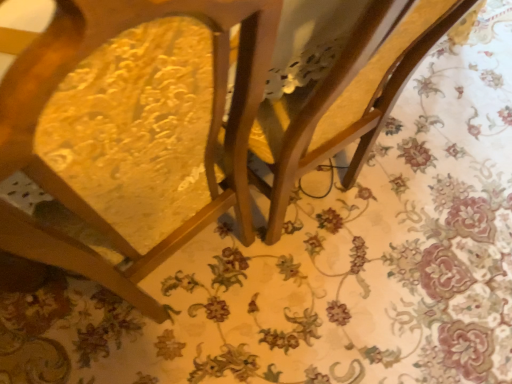
Locate an element on the screen. The image size is (512, 384). wooden chair at center is located at coordinates (206, 144).

Describe the element at coordinates (206, 144) in the screenshot. I see `wooden chair at center` at that location.

Describe the element at coordinates (346, 97) in the screenshot. This screenshot has width=512, height=384. I see `wooden swivel chair at center` at that location.

Measure the distance between wooden swivel chair at center and camera.

wooden swivel chair at center is 18.54 inches from camera.

The height and width of the screenshot is (384, 512). Find the location of `wooden swivel chair at center`. wooden swivel chair at center is located at coordinates (346, 97).

Locate an element on the screen. The width and height of the screenshot is (512, 384). wooden chair at center is located at coordinates (206, 144).

Which is more to the left, wooden chair at center or wooden swivel chair at center?

wooden chair at center is more to the left.

Is wooden chair at center closer to camera compared to wooden swivel chair at center?

That is True.

Considering the positions of points (214, 204) and (349, 95), is point (214, 204) farther from camera compared to point (349, 95)?

That is True.

From the image's perspective, which is above, wooden chair at center or wooden swivel chair at center?

wooden swivel chair at center, from the image's perspective.

From a real-world perspective, which is physically above, wooden chair at center or wooden swivel chair at center?

wooden chair at center, from a real-world perspective.

Which of these two, wooden chair at center or wooden swivel chair at center, is wider?

wooden chair at center.

Considering the sizes of objects wooden chair at center and wooden swivel chair at center in the image provided, who is shorter, wooden chair at center or wooden swivel chair at center?

Standing shorter between the two is wooden swivel chair at center.

Based on the photo, considering the sizes of wooden chair at center and wooden swivel chair at center in the image, is wooden chair at center bigger or smaller than wooden swivel chair at center?

In the image, wooden chair at center appears to be larger than wooden swivel chair at center.

Consider the image. Would you say wooden chair at center is outside wooden swivel chair at center?

Indeed, wooden chair at center is completely outside wooden swivel chair at center.

Does wooden chair at center touch wooden swivel chair at center?

No, wooden chair at center is not next to wooden swivel chair at center.

Could you tell me if wooden chair at center is turned towards wooden swivel chair at center?

No, wooden chair at center is not facing towards wooden swivel chair at center.

Can you tell me how much wooden chair at center and wooden swivel chair at center differ in facing direction?

5.52 degrees separate the facing orientations of wooden chair at center and wooden swivel chair at center.

You are a GUI agent. You are given a task and a screenshot of the screen. Output one action in this format:
    pyautogui.click(x=<x>, y=<y>)
    Task: Click on the chair above the wooden swivel chair at center (from a real-world perspective)
    The height and width of the screenshot is (384, 512).
    Given the screenshot: What is the action you would take?
    (206, 144)

Does wooden swivel chair at center appear on the right side of wooden chair at center?

Indeed, wooden swivel chair at center is positioned on the right side of wooden chair at center.

Who is more distant, wooden swivel chair at center or wooden chair at center?

wooden swivel chair at center is behind.

In the scene shown: Which is less distant, (414, 68) or (262, 52)?

Positioned in front is point (262, 52).

From the image's perspective, which one is positioned higher, wooden swivel chair at center or wooden chair at center?

wooden swivel chair at center.

From a real-world perspective, which object stands above the other?

In real-world perspective, wooden chair at center is above.

In terms of width, does wooden swivel chair at center look wider or thinner when compared to wooden chair at center?

Clearly, wooden swivel chair at center has less width compared to wooden chair at center.

Between wooden swivel chair at center and wooden chair at center, which one has more height?

Standing taller between the two is wooden chair at center.

Does wooden swivel chair at center have a larger size compared to wooden chair at center?

No, wooden swivel chair at center is not bigger than wooden chair at center.

Is wooden swivel chair at center outside of wooden chair at center?

Indeed, wooden swivel chair at center is completely outside wooden chair at center.

Are wooden swivel chair at center and wooden chair at center far apart?

Actually, wooden swivel chair at center and wooden chair at center are a little close together.

Could you tell me if wooden swivel chair at center is facing wooden chair at center?

No, wooden swivel chair at center is not facing towards wooden chair at center.

How many degrees apart are the facing directions of wooden swivel chair at center and wooden chair at center?

The angle between the facing direction of wooden swivel chair at center and the facing direction of wooden chair at center is 5.52 degrees.

In the image, there is a wooden chair at center. Identify the location of swivel chair above it (from the image's perspective). The width and height of the screenshot is (512, 384). (346, 97).

Image resolution: width=512 pixels, height=384 pixels. In order to click on swivel chair that is behind the wooden chair at center in this screenshot , I will do `click(346, 97)`.

Find the location of a particular element. The height and width of the screenshot is (384, 512). swivel chair above the wooden chair at center (from the image's perspective) is located at coordinates (346, 97).